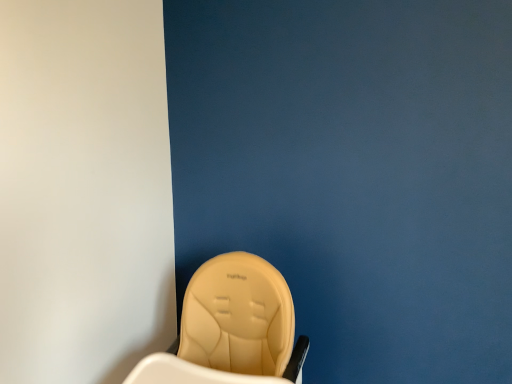
Question: Should I look upward or downward to see beige leather high chair at lower left?

Choices:
 (A) up
 (B) down

Answer: (B)